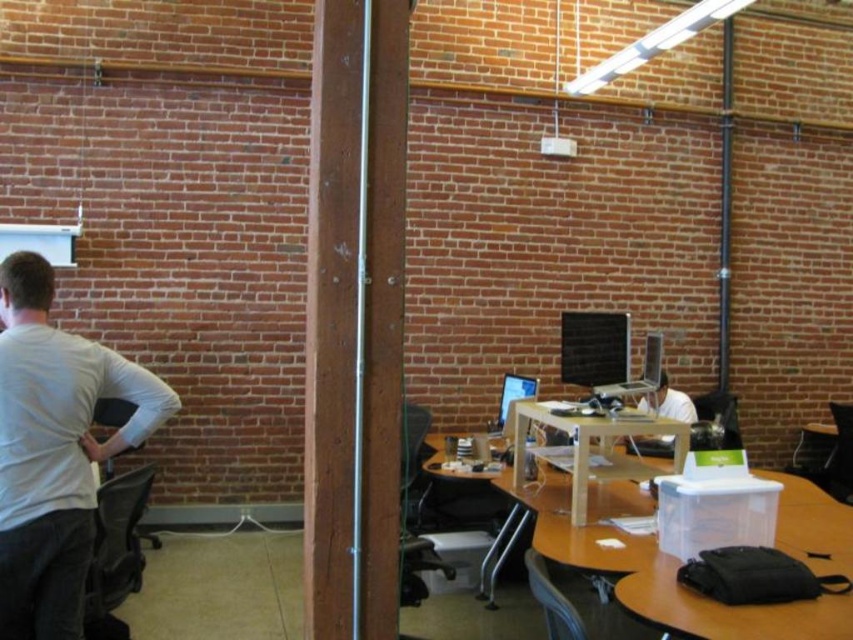
You are standing in an office with a brick wall and a central wooden beam. You see a white matte shirt at left and a black mesh office chair at left. From your perspective, which object is positioned more to the right?

The white matte shirt at left is positioned to the right of the black mesh office chair at left, so it is more to the right.

You are an office worker who needs to move from your current position to the black mesh office chair at left. The minimum safe distance required to avoid bumping into the white matte shirt at left is 50 centimeters. Can you safely move to the chair without getting too close?

The distance between the white matte shirt at left and the black mesh office chair at left is 55.42 centimeters, which is greater than the required 50 centimeters. Therefore, you can safely move to the chair without getting too close.